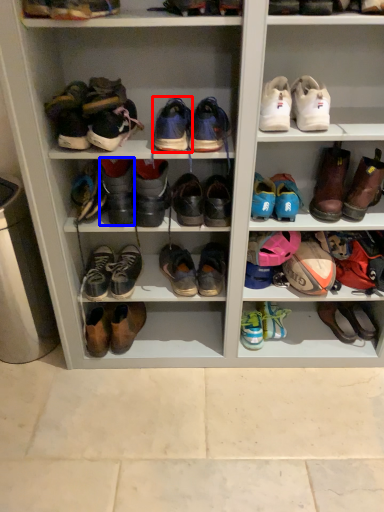
Question: Among these objects, which one is farthest to the camera, footwear (highlighted by a red box) or footwear (highlighted by a blue box)?

Choices:
 (A) footwear
 (B) footwear

Answer: (B)